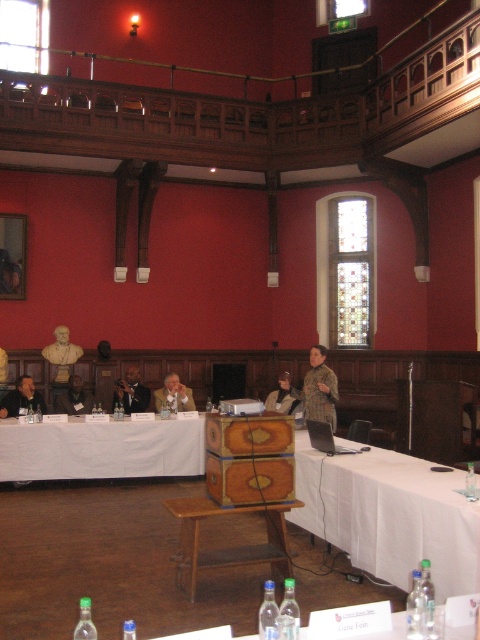
You are organizing a small event and need to decide whether to place a decorative item on the white cloth at lower left or the matte black jacket at left. Based on their sizes, which surface would be more stable for the item?

The white cloth at lower left has a larger width than the matte black jacket at left, so placing the decorative item on the white cloth at lower left would provide a more stable surface.

You are organizing a small event and need to decide whether to use the white cloth at lower left or the matte black jacket at left as a makeshift table cover. Based on their sizes, which one would be more suitable for covering a standard table?

The white cloth at lower left is larger in size compared to the matte black jacket at left, so it would be more suitable for covering a standard table.

You are a guest at this conference and need to place your matte black jacket at left on the white cloth at lower left. Will the jacket fit on the cloth without hanging over the edges?

The white cloth at lower left has a greater height compared to the matte black jacket at left, so the jacket will fit on the cloth without hanging over the edges.